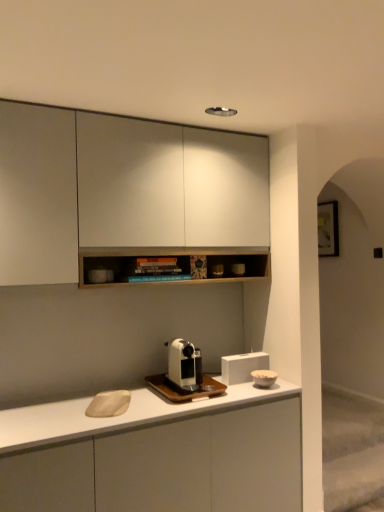
Question: Do you think white glossy coffee machine at center, which is counted as the 2th coffee machine, starting from the bottom, is within porcelain bowl at right, which ranks as the 1th appliance in front-to-back order, or outside of it?

Choices:
 (A) inside
 (B) outside

Answer: (B)

Question: Looking at the image, does white glossy coffee machine at center, the first coffee machine when ordered from top to bottom, seem bigger or smaller compared to porcelain bowl at right, the second appliance viewed from the back?

Choices:
 (A) big
 (B) small

Answer: (A)

Question: Which object is the closest to the white matte speaker at center, the 2th appliance from the front?

Choices:
 (A) white glossy coffee machine at center, which is counted as the 2th coffee machine, starting from the bottom
 (B) white glossy coffee machine at center, which is the 2th coffee machine in top-to-bottom order
 (C) porcelain bowl at right, which ranks as the 1th appliance in front-to-back order
 (D) white matte cabinet at upper center, the second cabinetry in the bottom-to-top sequence
 (E) white matte cabinet at center, which is the second cabinetry from top to bottom

Answer: (C)

Question: Which of these objects is positioned farthest from the white matte cabinet at upper center, the second cabinetry in the bottom-to-top sequence?

Choices:
 (A) white glossy coffee machine at center, which is counted as the 2th coffee machine, starting from the bottom
 (B) porcelain bowl at right, the second appliance viewed from the back
 (C) white glossy coffee machine at center, placed as the first coffee machine when sorted from bottom to top
 (D) white matte cabinet at center, marked as the 1th cabinetry in a bottom-to-top arrangement
 (E) white matte speaker at center, the 2th appliance from the front

Answer: (B)